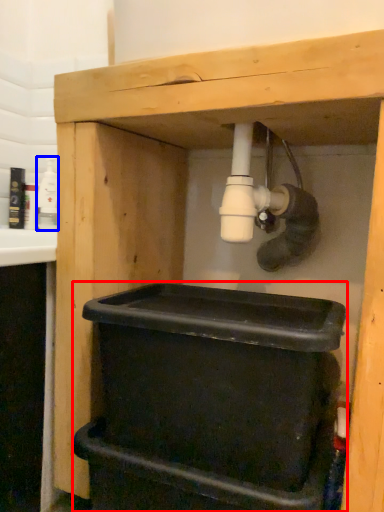
Question: Which point is closer to the camera, recycling bin (highlighted by a red box) or bottle (highlighted by a blue box)?

Choices:
 (A) recycling bin
 (B) bottle

Answer: (A)